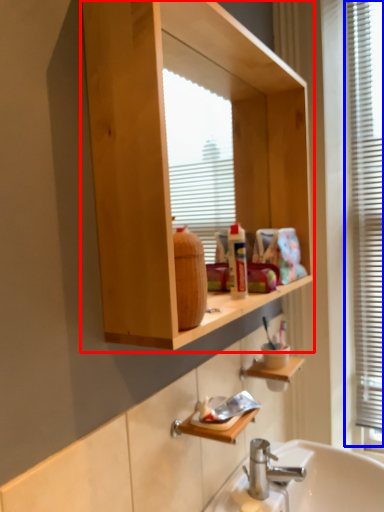
Question: Which point is further to the camera, bathroom cabinet (highlighted by a red box) or window frame (highlighted by a blue box)?

Choices:
 (A) bathroom cabinet
 (B) window frame

Answer: (B)